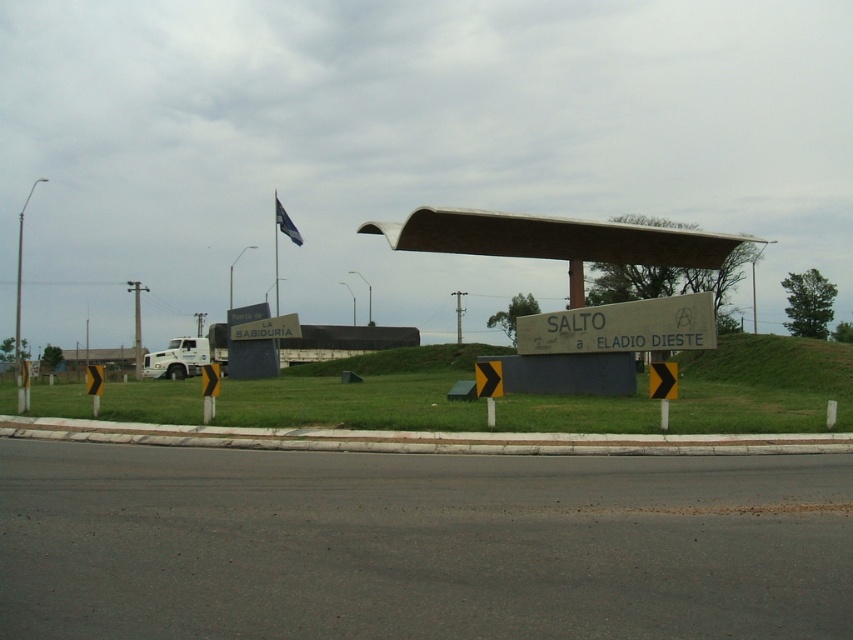
Is point (641, 328) closer to viewer compared to point (288, 228)?

That is True.

Describe the element at coordinates (621, 326) in the screenshot. I see `wooden sign at center` at that location.

Is point (688, 301) farther from camera compared to point (289, 232)?

No, it is in front of (289, 232).

In order to click on wooden sign at center in this screenshot , I will do `click(621, 326)`.

Is point (444, 524) behind point (547, 336)?

No, (444, 524) is in front of (547, 336).

Find the location of a particular element. This screenshot has width=853, height=640. black asphalt highway at center is located at coordinates (419, 545).

The height and width of the screenshot is (640, 853). Find the location of `black asphalt highway at center`. black asphalt highway at center is located at coordinates (419, 545).

Can you confirm if brown corrugated metal canopy at center is thinner than blue fabric flag at upper center?

Incorrect, brown corrugated metal canopy at center's width is not less than blue fabric flag at upper center's.

Is brown corrugated metal canopy at center to the right of blue fabric flag at upper center from the viewer's perspective?

Yes, brown corrugated metal canopy at center is to the right of blue fabric flag at upper center.

Is point (453, 243) positioned before point (279, 209)?

Yes, point (453, 243) is in front of point (279, 209).

This screenshot has height=640, width=853. In order to click on brown corrugated metal canopy at center in this screenshot , I will do `click(554, 237)`.